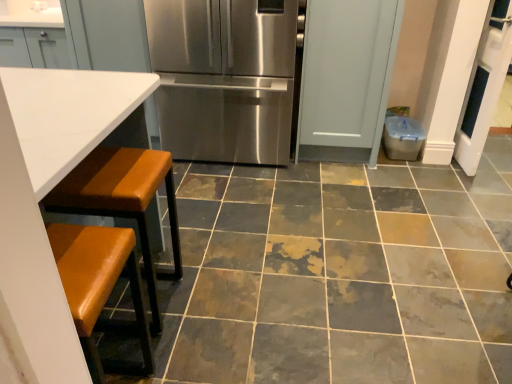
The height and width of the screenshot is (384, 512). Identify the location of free location to the right of brown leather stool at lower left. (213, 299).